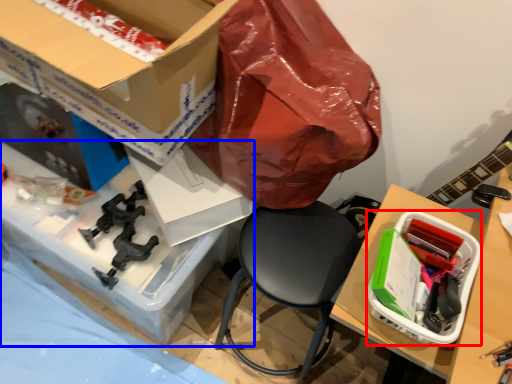
Question: Which object appears farthest to the camera in this image, box (highlighted by a red box) or desk (highlighted by a blue box)?

Choices:
 (A) box
 (B) desk

Answer: (B)